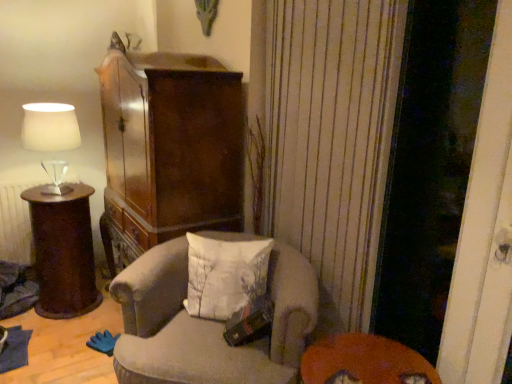
Find the location of `free point below white fabric lampshade at left (from a real-world perspective)`. free point below white fabric lampshade at left (from a real-world perspective) is located at coordinates (58, 188).